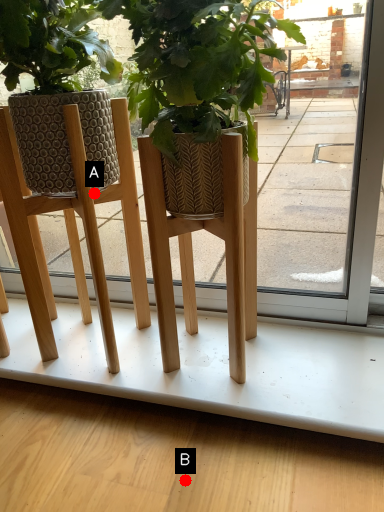
Question: Two points are circled on the image, labeled by A and B beside each circle. Which point is further to the camera?

Choices:
 (A) A is further
 (B) B is further

Answer: (A)